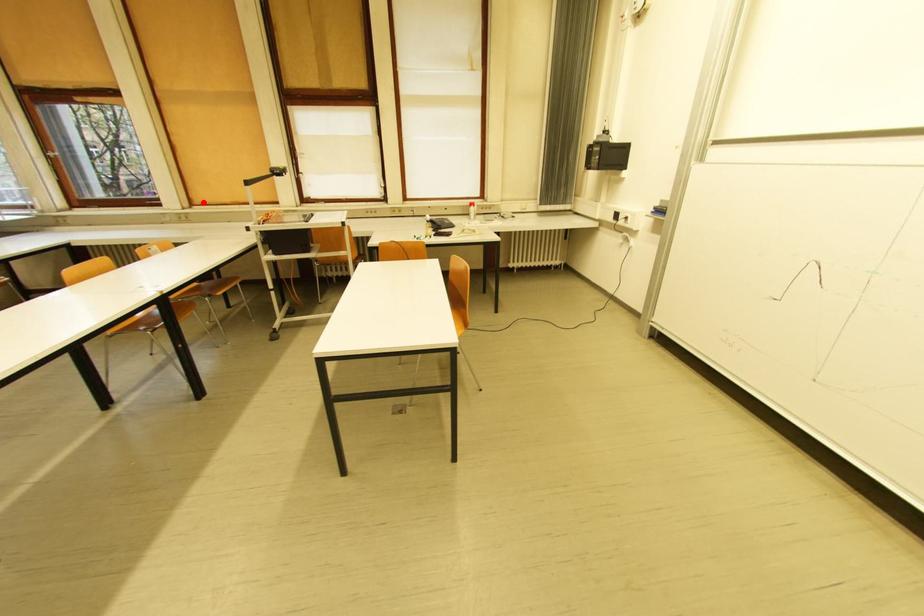
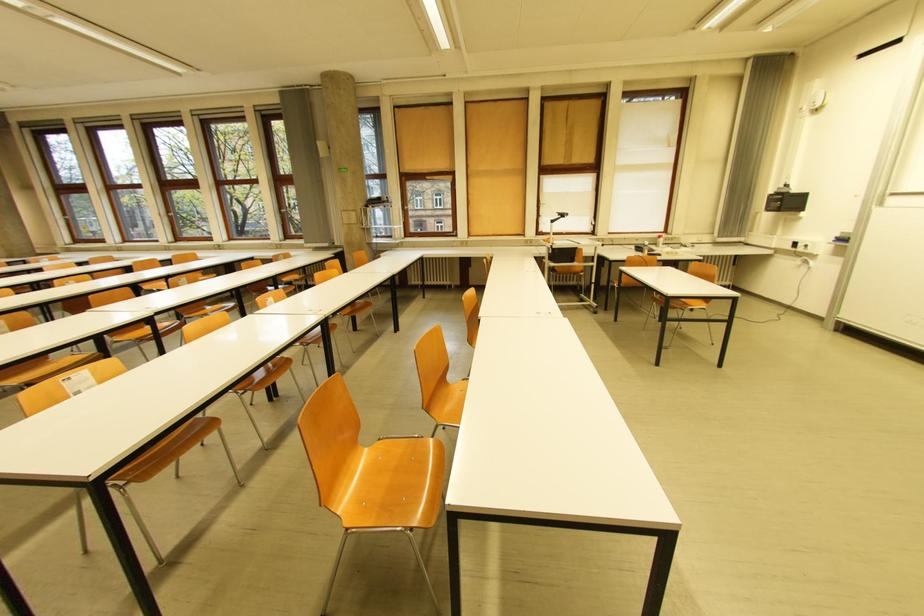
Where in the second image is the point corresponding to the highlighted location from the first image?

(479, 235)